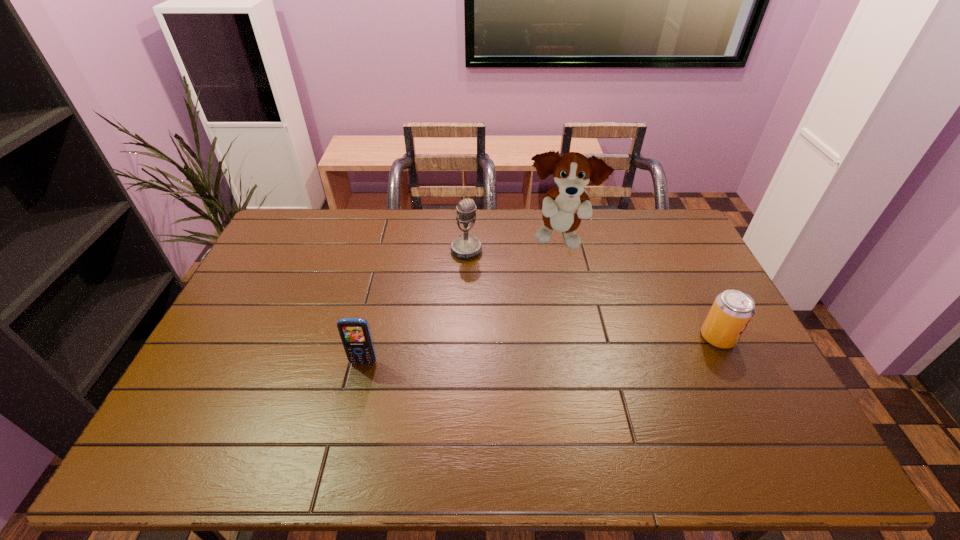
Image resolution: width=960 pixels, height=540 pixels. Find the location of `vacant position located on the face of the tallest object`. vacant position located on the face of the tallest object is located at coordinates (580, 301).

Image resolution: width=960 pixels, height=540 pixels. Identify the location of vacant region located on the face of the tallest object. (583, 308).

Locate an element on the screen. The image size is (960, 540). free space located on the face of the tallest object is located at coordinates (580, 299).

The width and height of the screenshot is (960, 540). I want to click on vacant space located 0.280m on the front-facing side of the microphone, so [x=511, y=314].

I want to click on vacant region located 0.210m on the front-facing side of the microphone, so pos(500,299).

This screenshot has height=540, width=960. In order to click on vacant space positioned 0.150m on the front-facing side of the microphone in this screenshot , I will do `click(492, 287)`.

The width and height of the screenshot is (960, 540). Identify the location of puppy that is at the far edge. (564, 206).

Where is `microphone that is at the far edge`? microphone that is at the far edge is located at coordinates (466, 246).

Where is `object situated at the right edge`? The height and width of the screenshot is (540, 960). object situated at the right edge is located at coordinates (732, 310).

In the image, there is a desktop. Find the location of `free space at the far edge`. free space at the far edge is located at coordinates (588, 228).